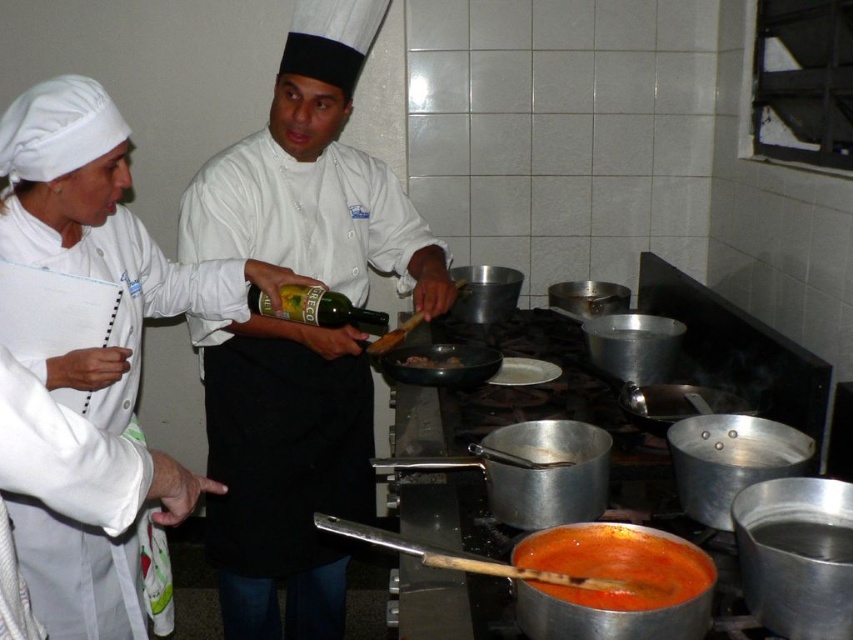
You are a new chef entering the kitchen and need to reach the white matte exhaust hood at upper center from your current position near the white glossy chef coat at left. The kitchen has a strict rule that you must stay at least 60 centimeters away from any chef to avoid interference. Can you safely proceed to the exhaust hood without violating this rule?

The distance between the white glossy chef coat at left and the white matte exhaust hood at upper center is 72.69 centimeters. Since this distance exceeds the required 60 centimeters, you can safely proceed to the exhaust hood without violating the kitchen rule.

You are a kitchen assistant and need to retrieve the white glossy chef hat at center and the white glossy chef coat at left for cleaning. Based on their positions, which item is closer to the right side of the kitchen counter?

The white glossy chef hat at center is closer to the right side of the kitchen counter because it is positioned on the right side of the white glossy chef coat at left.

You are a new chef entering the kitchen and need to locate the white glossy chef coat at left and the white matte exhaust hood at upper center. From your perspective standing at the entrance, which object is closer to the left side of the kitchen?

The white glossy chef coat at left is closer to the left side of the kitchen because it is positioned to the left of the white matte exhaust hood at upper center.